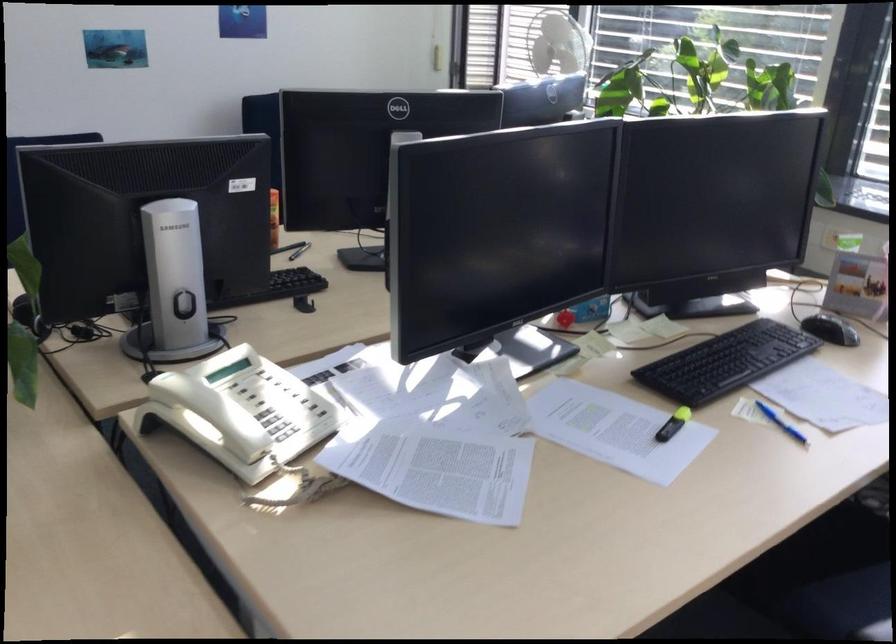
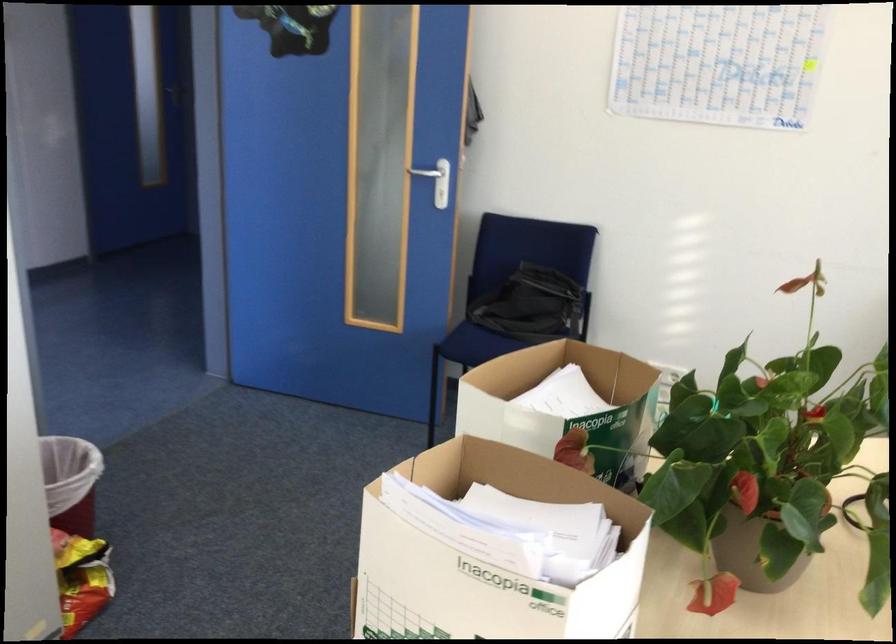
Question: The camera is either moving clockwise (left) or counter-clockwise (right) around the object. The first image is from the beginning of the video and the second image is from the end. Is the camera moving left or right when shooting the video?

Choices:
 (A) Left
 (B) Right

Answer: (B)